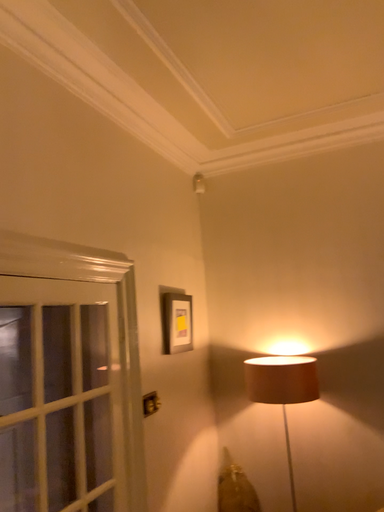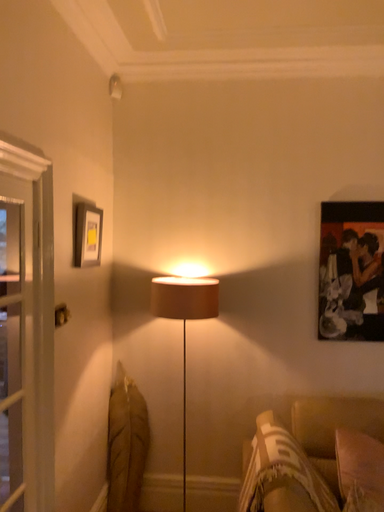
Question: How did the camera likely rotate when shooting the video?

Choices:
 (A) rotated left
 (B) rotated right

Answer: (B)